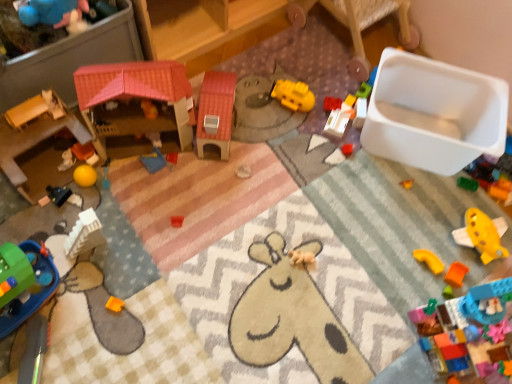
Identify the location of free space that is in between orange matte block at lower right, which ranks as the second toy in right-to-left order, and black plastic toy at lower left, the 13th toy from the right. Image resolution: width=512 pixels, height=384 pixels. (259, 240).